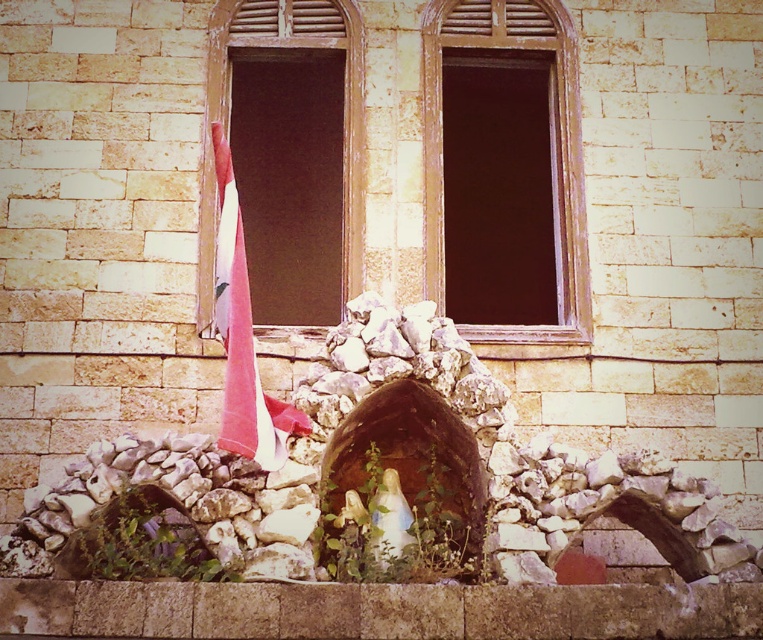
Can you confirm if wooden frame at center is thinner than wooden window at center?

No.

Does wooden frame at center lie behind wooden window at center?

Yes, wooden frame at center is behind wooden window at center.

Between point (557, 195) and point (211, 40), which one is positioned behind?

The point (211, 40) is behind.

You are a GUI agent. You are given a task and a screenshot of the screen. Output one action in this format:
    pyautogui.click(x=<x>, y=<y>)
    Task: Click on the wooden frame at center
    The height and width of the screenshot is (640, 763).
    Given the screenshot: What is the action you would take?
    pyautogui.click(x=549, y=148)

Measure the distance between wooden frame at center and camera.

wooden frame at center is 44.76 meters away from camera.

Looking at this image, can you confirm if wooden frame at center is positioned above pink fabric umbrella at left?

Yes.

Is point (559, 189) positioned after point (237, 305)?

Yes, it is.

This screenshot has height=640, width=763. Identify the location of wooden frame at center. (549, 148).

Identify the location of brown stone ledge at lower center. The image size is (763, 640). (378, 611).

Does brown stone ledge at lower center have a greater width compared to wooden window at center?

Correct, the width of brown stone ledge at lower center exceeds that of wooden window at center.

Between point (657, 598) and point (269, 33), which one is positioned in front?

Positioned in front is point (657, 598).

What are the coordinates of `brown stone ledge at lower center` in the screenshot? It's located at (378, 611).